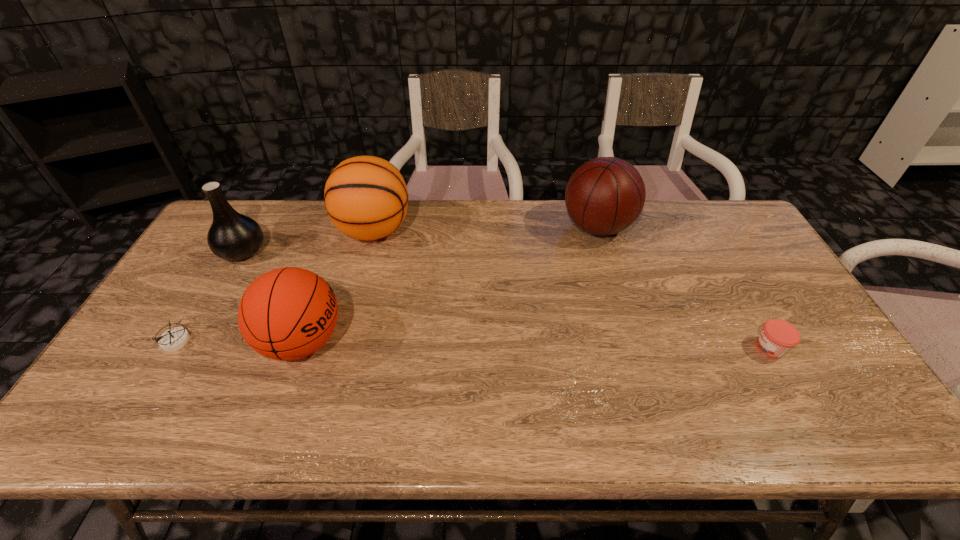
Image resolution: width=960 pixels, height=540 pixels. In order to click on vacant area located 0.200m on the front label of the jam in this screenshot , I will do `click(676, 348)`.

What are the coordinates of `vacant region located on the front label of the jam` in the screenshot? It's located at (664, 348).

At what (x,y) coordinates should I click in order to perform the action: click on vacant space located 0.180m on the back of the compass. Please return your answer as a coordinate pair (x, y). Looking at the image, I should click on (212, 281).

Find the location of a particular element. The image size is (960, 540). vase that is at the far edge is located at coordinates (232, 236).

This screenshot has width=960, height=540. I want to click on vase situated at the left edge, so pos(232,236).

Identify the location of compass present at the left edge. (173, 339).

This screenshot has width=960, height=540. I want to click on object situated at the right edge, so click(777, 337).

You are a GUI agent. You are given a task and a screenshot of the screen. Output one action in this format:
    pyautogui.click(x=<x>, y=<y>)
    Task: Click on the object that is at the far left corner
    The height and width of the screenshot is (540, 960).
    Given the screenshot: What is the action you would take?
    pyautogui.click(x=232, y=236)

I want to click on vacant area at the far edge of the desktop, so click(460, 206).

Find the location of a particular element. The width and height of the screenshot is (960, 540). free region at the near edge of the desktop is located at coordinates (171, 424).